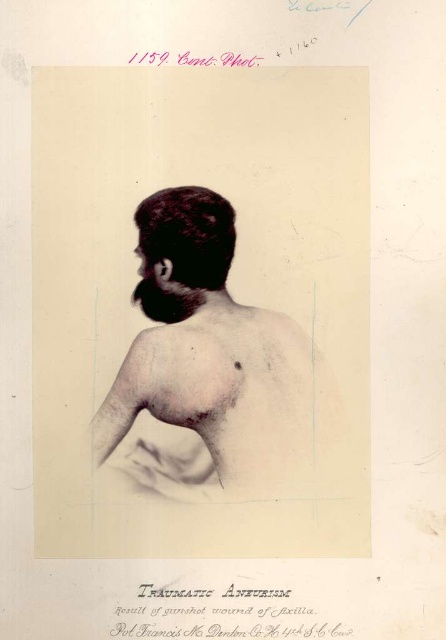
Does smooth skin back at center have a greater width compared to dark matte hair at center?

Yes, smooth skin back at center is wider than dark matte hair at center.

Which is behind, point (172, 330) or point (205, 214)?

Point (172, 330)

Who is more distant from viewer, (x=152, y=260) or (x=231, y=212)?

Positioned behind is point (x=231, y=212).

Locate an element on the screen. smooth skin back at center is located at coordinates (211, 355).